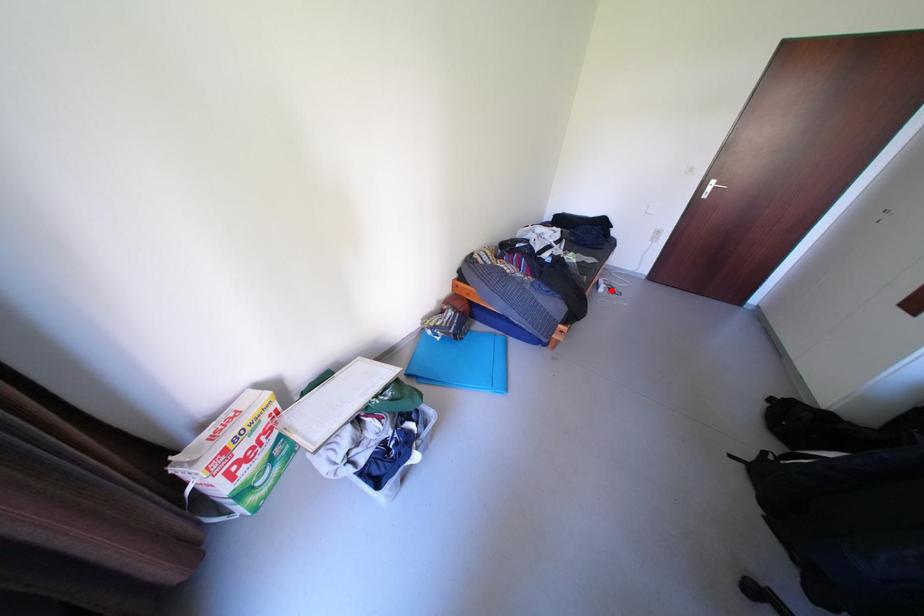
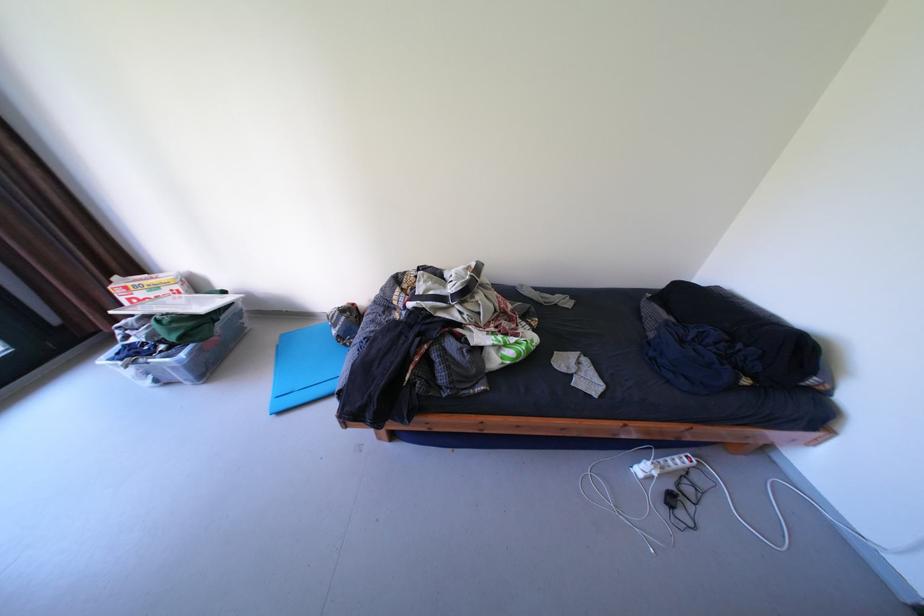
Find the pixel in the second image that matches the highlighted location in the first image.

(649, 471)